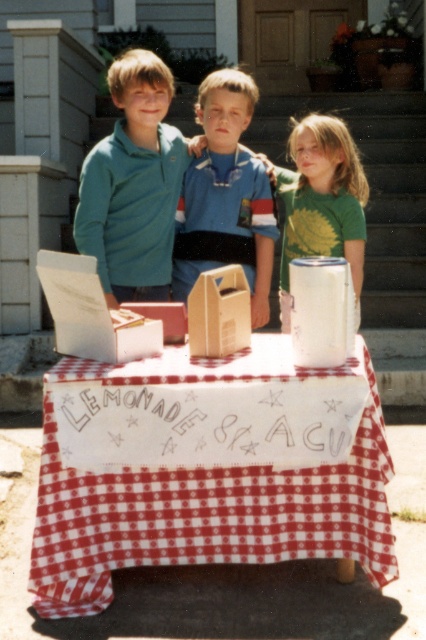
Question: Observing the image, what is the correct spatial positioning of red checkered tablecloth at center in reference to teal fleece jacket at upper left?

Choices:
 (A) right
 (B) left

Answer: (A)

Question: Does red checkered tablecloth at center have a lesser width compared to blue fabric shirt at center?

Choices:
 (A) yes
 (B) no

Answer: (B)

Question: Can you confirm if blue fabric shirt at center is positioned below teal fleece jacket at upper left?

Choices:
 (A) yes
 (B) no

Answer: (A)

Question: Based on their relative distances, which object is farther from the blue fabric shirt at center?

Choices:
 (A) green matte shirt at center
 (B) teal fleece jacket at upper left
 (C) red checkered tablecloth at center

Answer: (C)

Question: Which object is closer to the camera taking this photo?

Choices:
 (A) green matte shirt at center
 (B) teal fleece jacket at upper left
 (C) red checkered tablecloth at center

Answer: (C)

Question: Which object is the closest to the blue fabric shirt at center?

Choices:
 (A) teal fleece jacket at upper left
 (B) green matte shirt at center
 (C) red checkered tablecloth at center

Answer: (A)